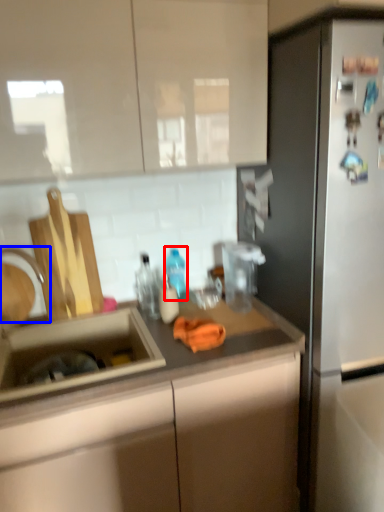
Question: Which of the following is the farthest to the observer, bottle (highlighted by a red box) or faucet (highlighted by a blue box)?

Choices:
 (A) bottle
 (B) faucet

Answer: (A)